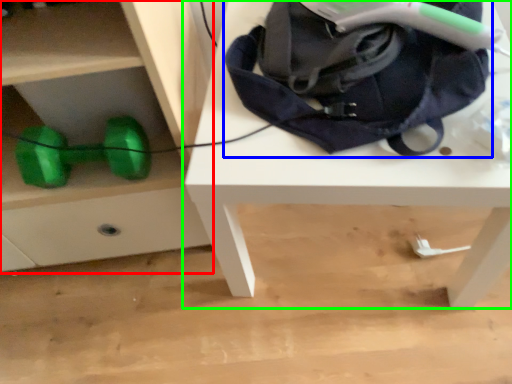
Question: Estimate the real-world distances between objects in this image. Which object is farther from chest of drawers (highlighted by a red box), bag (highlighted by a blue box) or table (highlighted by a green box)?

Choices:
 (A) bag
 (B) table

Answer: (A)